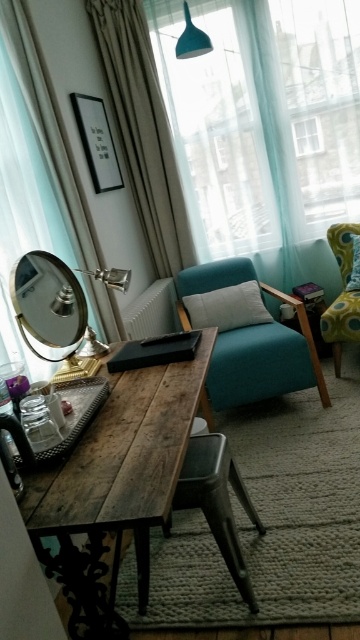
You are designing a layout for a room and need to ensure that the beige fabric curtain at upper left and the metallic silver chair at center are placed appropriately. Which object should be positioned higher to maintain visual balance?

The beige fabric curtain at upper left should be positioned higher since it has a greater height compared to the metallic silver chair at center.